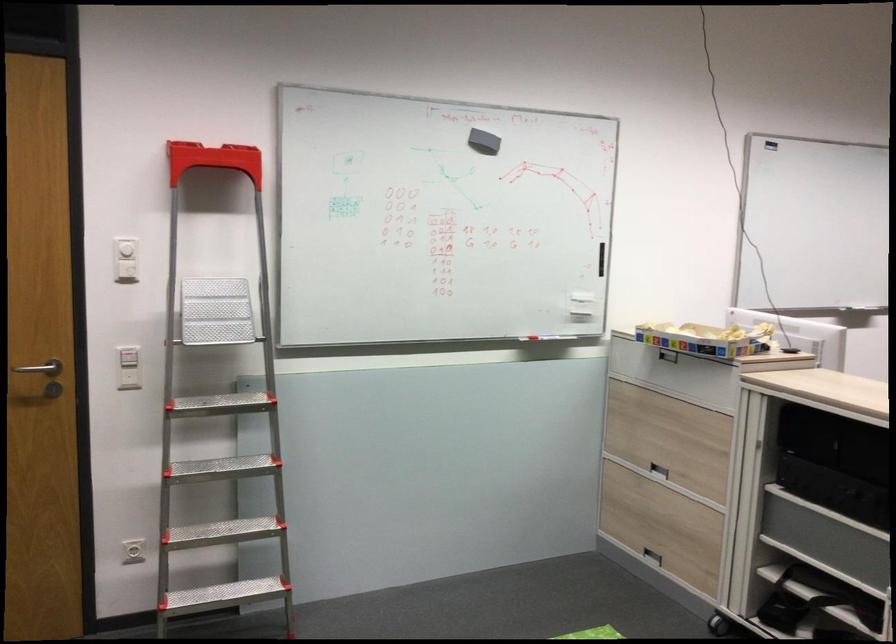
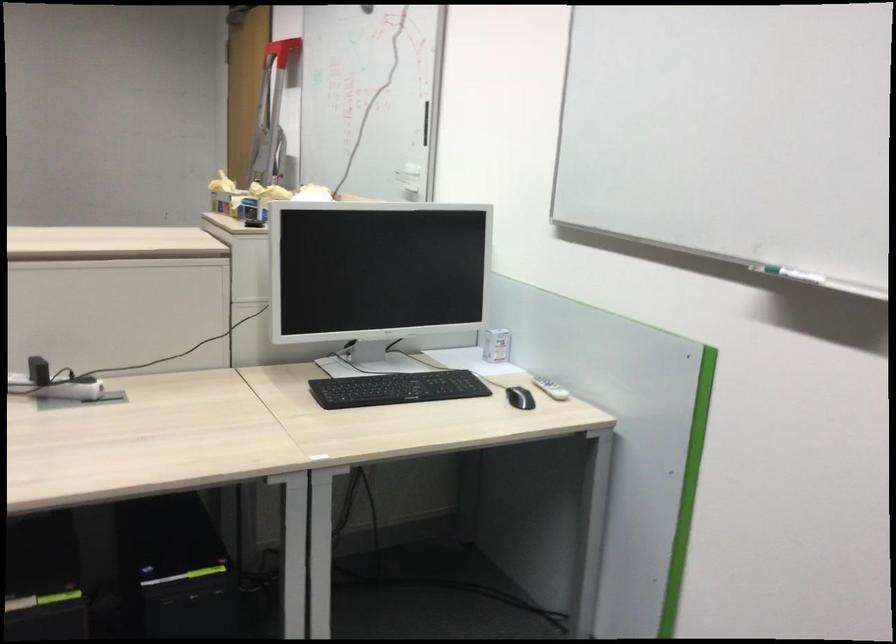
Question: I am providing you with two images of the same scene from different viewpoints. Which of the following objects are not visible in image2?

Choices:
 (A) metal flower bowl
 (B) black computer mouse
 (C) whiteboard marker
 (D) recessed drawer handle

Answer: (D)